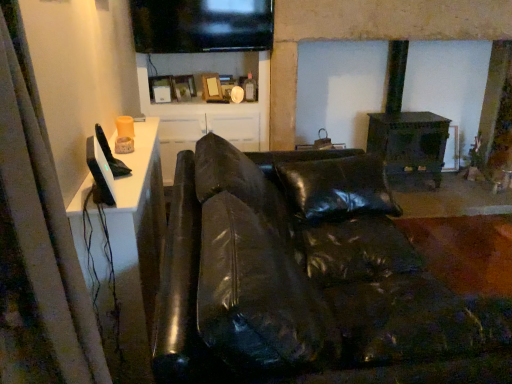
Question: Considering the positions of point (186, 142) and point (10, 142), is point (186, 142) closer or farther from the camera than point (10, 142)?

Choices:
 (A) closer
 (B) farther

Answer: (B)

Question: Is white glossy cabinet at upper center to the left or to the right of white fabric curtain at left in the image?

Choices:
 (A) right
 (B) left

Answer: (B)

Question: Which object is positioned closest to the white fabric curtain at left?

Choices:
 (A) white glossy cabinet at upper center
 (B) black leather couch at center

Answer: (B)

Question: Which object is the closest to the black leather couch at center?

Choices:
 (A) white glossy cabinet at upper center
 (B) white fabric curtain at left

Answer: (B)